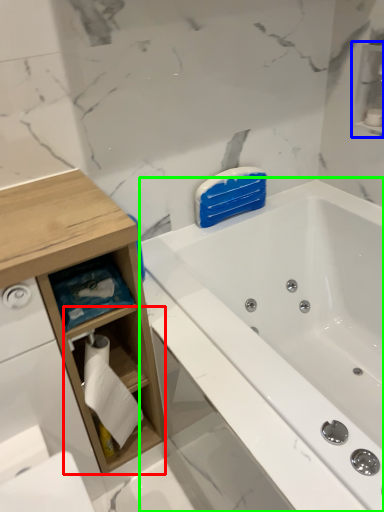
Question: Which object is positioned farthest from cabinet (highlighted by a red box)? Select from cabinet (highlighted by a blue box) and bathtub (highlighted by a green box).

Choices:
 (A) cabinet
 (B) bathtub

Answer: (A)